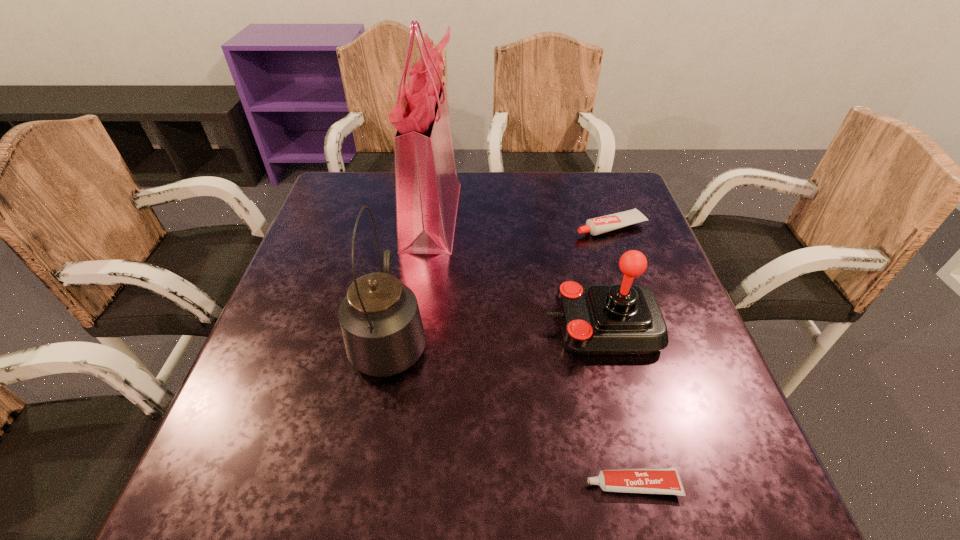
Find the location of `unoccupied position between the kettle and the joystick`. unoccupied position between the kettle and the joystick is located at coordinates (495, 332).

You are a GUI agent. You are given a task and a screenshot of the screen. Output one action in this format:
    pyautogui.click(x=<x>, y=<y>)
    Task: Click on the vacant space that is in between the shorter toothpaste and the shopping bag
    This screenshot has height=540, width=960.
    Given the screenshot: What is the action you would take?
    pyautogui.click(x=533, y=349)

This screenshot has width=960, height=540. In order to click on free space between the kettle and the joystick in this screenshot , I will do `click(495, 332)`.

You are a GUI agent. You are given a task and a screenshot of the screen. Output one action in this format:
    pyautogui.click(x=<x>, y=<y>)
    Task: Click on the free space between the taller toothpaste and the joystick
    
    Given the screenshot: What is the action you would take?
    pyautogui.click(x=606, y=276)

The width and height of the screenshot is (960, 540). What are the coordinates of `vacant area that lies between the shortest object and the second shortest object` in the screenshot? It's located at (621, 355).

The image size is (960, 540). What are the coordinates of `free space between the kettle and the shopping bag` in the screenshot? It's located at (411, 276).

Where is `unoccupied position between the farther toothpaste and the joystick`? Image resolution: width=960 pixels, height=540 pixels. unoccupied position between the farther toothpaste and the joystick is located at coordinates (606, 276).

Locate an element on the screen. vacant area between the tallest object and the nearer toothpaste is located at coordinates (533, 349).

Where is `vacant area that lies between the joystick and the tallest object`? The image size is (960, 540). vacant area that lies between the joystick and the tallest object is located at coordinates (516, 270).

I want to click on vacant point located between the fourth tallest object and the second tallest object, so click(500, 282).